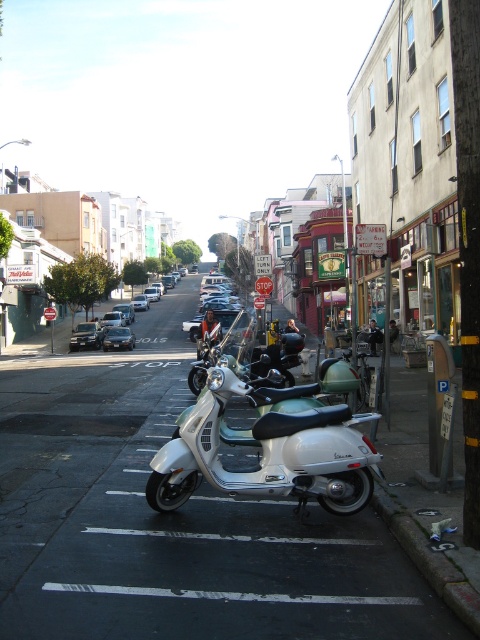
Question: Which of the following is the closest to the observer?

Choices:
 (A) (388, 602)
 (B) (307, 536)
 (C) (228, 298)
 (D) (156, 330)

Answer: (A)

Question: Which object is positioned farthest from the white asphalt at center?

Choices:
 (A) white glossy line at lower center
 (B) matte black sedan at left
 (C) white painted line at lower center

Answer: (B)

Question: Is white metallic scooter at center below white glossy line at lower center?

Choices:
 (A) yes
 (B) no

Answer: (B)

Question: Is white asphalt at center below matte black sedan at left?

Choices:
 (A) yes
 (B) no

Answer: (A)

Question: Which object appears closest to the camera in this image?

Choices:
 (A) matte black sedan at center
 (B) white glossy line at lower center
 (C) silver metallic sedan at center
 (D) shiny silver car at center

Answer: (B)

Question: Can you confirm if white metallic scooter at center is smaller than white glossy line at lower center?

Choices:
 (A) no
 (B) yes

Answer: (A)